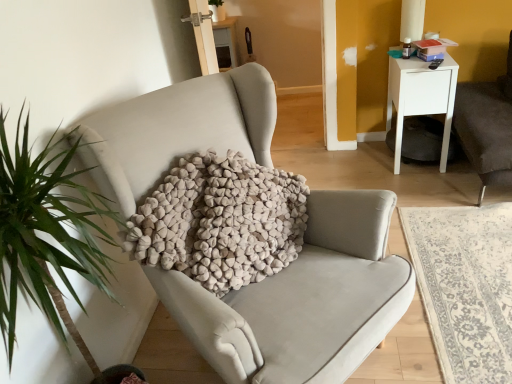
Question: Considering the relative positions of beige fabric chair at center and textured beige pillow at center in the image provided, is beige fabric chair at center in front of textured beige pillow at center?

Choices:
 (A) no
 (B) yes

Answer: (A)

Question: Is beige fabric chair at center taller than textured beige pillow at center?

Choices:
 (A) no
 (B) yes

Answer: (A)

Question: Are beige fabric chair at center and textured beige pillow at center located far from each other?

Choices:
 (A) yes
 (B) no

Answer: (B)

Question: Is beige fabric chair at center bigger than textured beige pillow at center?

Choices:
 (A) no
 (B) yes

Answer: (B)

Question: Is beige fabric chair at center smaller than textured beige pillow at center?

Choices:
 (A) no
 (B) yes

Answer: (A)

Question: From the image's perspective, is white glossy nightstand at upper right above or below beige fabric chair at center?

Choices:
 (A) above
 (B) below

Answer: (A)

Question: Looking at their shapes, would you say white glossy nightstand at upper right is wider or thinner than beige fabric chair at center?

Choices:
 (A) wide
 (B) thin

Answer: (B)

Question: Is white glossy nightstand at upper right bigger or smaller than beige fabric chair at center?

Choices:
 (A) big
 (B) small

Answer: (B)

Question: Relative to beige fabric chair at center, is white glossy nightstand at upper right in front or behind?

Choices:
 (A) behind
 (B) front

Answer: (A)

Question: From a real-world perspective, is black plastic remote control at upper right physically located above or below beige fabric chair at center?

Choices:
 (A) below
 (B) above

Answer: (B)

Question: Visually, is black plastic remote control at upper right positioned to the left or to the right of beige fabric chair at center?

Choices:
 (A) left
 (B) right

Answer: (B)

Question: Is black plastic remote control at upper right inside or outside of beige fabric chair at center?

Choices:
 (A) inside
 (B) outside

Answer: (B)

Question: Looking at the image, does black plastic remote control at upper right seem bigger or smaller compared to beige fabric chair at center?

Choices:
 (A) small
 (B) big

Answer: (A)

Question: Is textured beige pillow at center taller or shorter than black plastic remote control at upper right?

Choices:
 (A) tall
 (B) short

Answer: (A)

Question: Is textured beige pillow at center wider or thinner than black plastic remote control at upper right?

Choices:
 (A) thin
 (B) wide

Answer: (B)